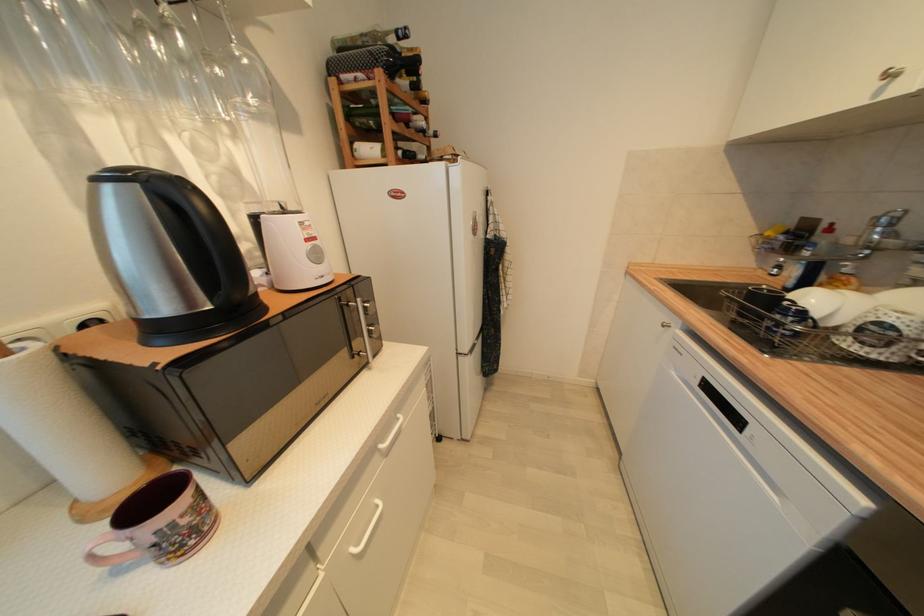
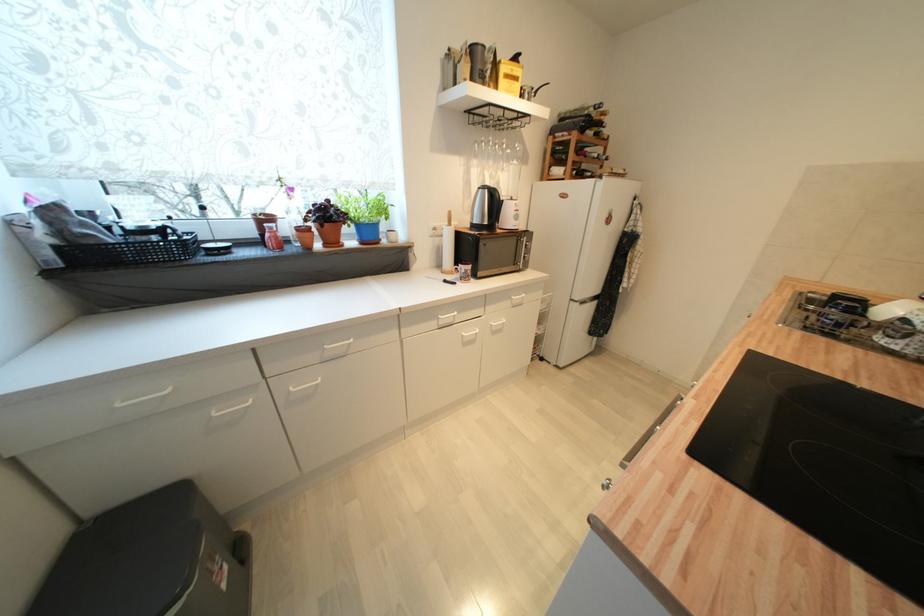
In the second image, find the point that corresponds to point 86,92 in the first image.

(480, 164)